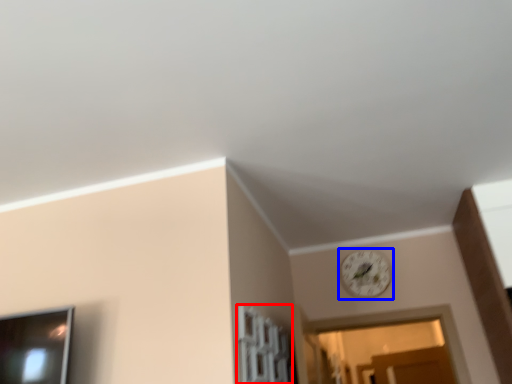
Question: Among these objects, which one is nearest to the camera, window (highlighted by a red box) or clock (highlighted by a blue box)?

Choices:
 (A) window
 (B) clock

Answer: (A)